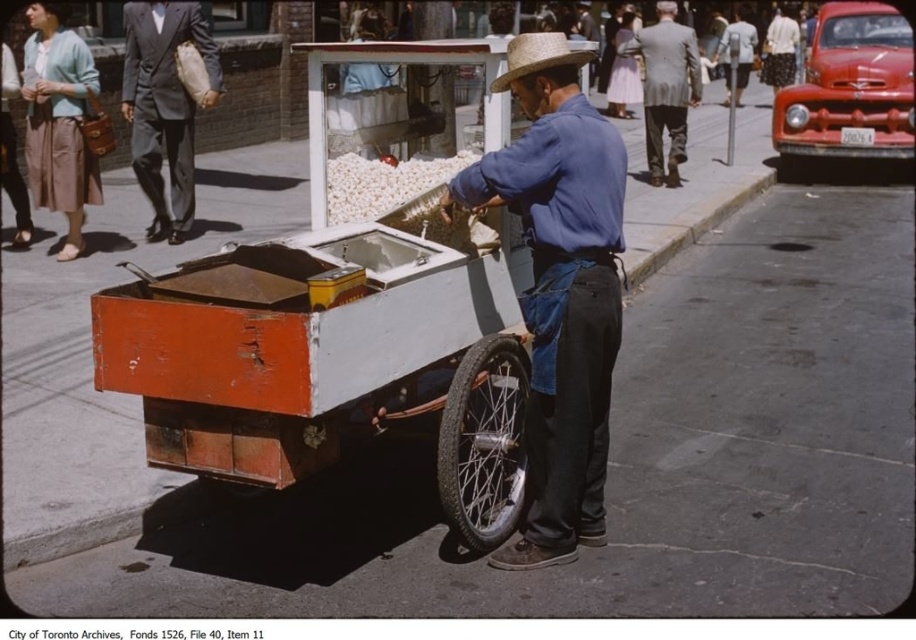
You are standing in front of the popcorn cart and want to take a photo. There are two points on the cart that you need to focus on. The first point is at coordinates point (586, 104) and the second is at point (494, 500). Which point should you focus on to ensure it appears larger in your photo?

Point (586, 104) is closer to the camera than point (494, 500), so focusing on point (586, 104) will make it appear larger in the photo.

You are a customer at the street market and want to buy some popcorn. Where should you look to find the white fluffy popcorn at center in relation to the rusty metal cart at center?

The white fluffy popcorn at center is above the rusty metal cart at center, so you should look upwards from the rusty metal cart at center to find it.